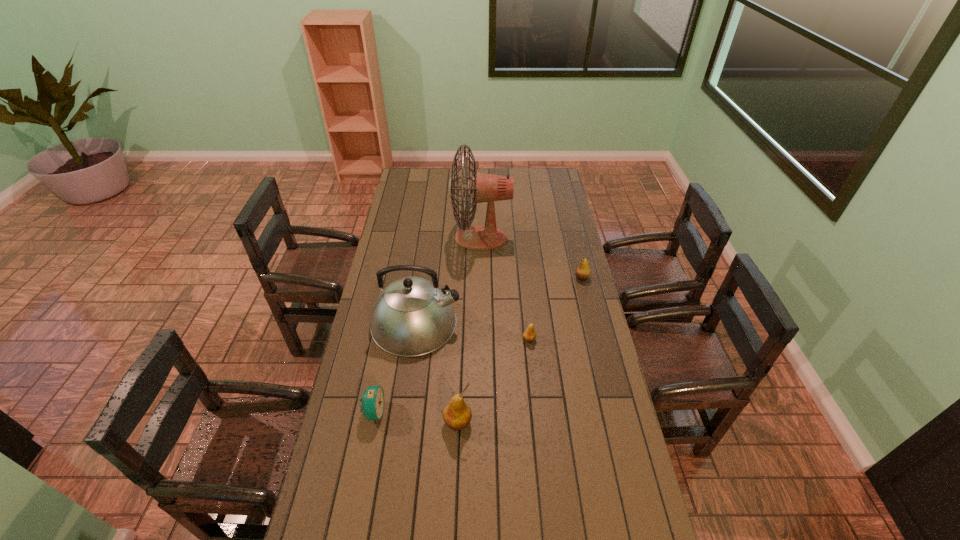
Identify the location of the tallest pear. (457, 414).

Image resolution: width=960 pixels, height=540 pixels. I want to click on the nearest pear, so click(457, 414).

The height and width of the screenshot is (540, 960). Find the location of `the second nearest pear`. the second nearest pear is located at coordinates (529, 335).

Find the location of a particular element. The height and width of the screenshot is (540, 960). the second object from right to left is located at coordinates (529, 335).

Find the location of a particular element. Image resolution: width=960 pixels, height=540 pixels. the second tallest pear is located at coordinates (583, 271).

At what (x,y) coordinates should I click in order to perform the action: click on the fifth nearest object. Please return your answer as a coordinate pair (x, y). The height and width of the screenshot is (540, 960). Looking at the image, I should click on (583, 271).

The image size is (960, 540). I want to click on kettle, so click(412, 316).

I want to click on the tallest object, so click(x=484, y=187).

Image resolution: width=960 pixels, height=540 pixels. What are the coordinates of `the farthest object` in the screenshot? It's located at (484, 187).

Find the location of a particular element. Image resolution: width=960 pixels, height=540 pixels. alarm clock is located at coordinates (372, 400).